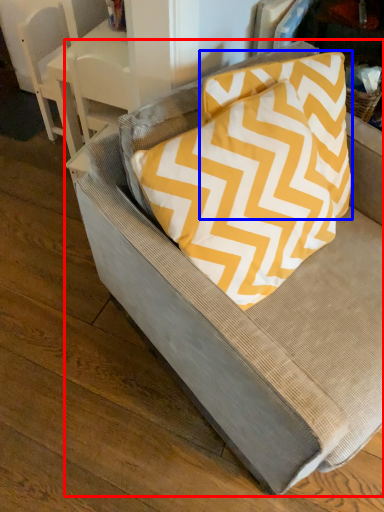
Question: Which point is closer to the camera, chair (highlighted by a red box) or pillow (highlighted by a blue box)?

Choices:
 (A) chair
 (B) pillow

Answer: (A)